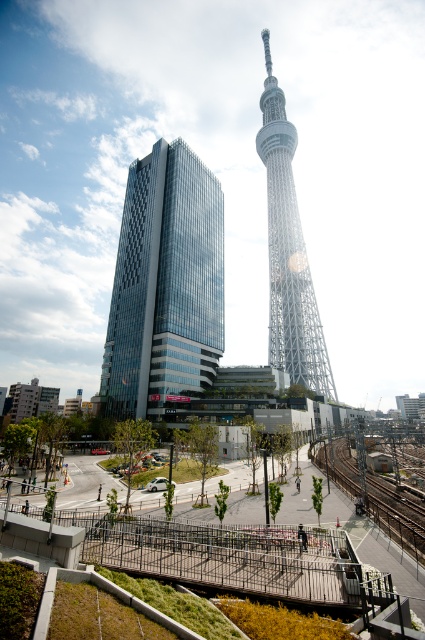
Question: Can you confirm if white lattice tower at center is positioned to the right of metal train track at lower center?

Choices:
 (A) no
 (B) yes

Answer: (B)

Question: Which object appears closest to the camera in this image?

Choices:
 (A) glassy modern building at center
 (B) white lattice tower at center
 (C) metal train track at lower center

Answer: (C)

Question: Which object is closer to the camera taking this photo?

Choices:
 (A) glassy modern building at center
 (B) white lattice tower at center

Answer: (A)

Question: Is the position of glassy modern building at center more distant than that of white lattice tower at center?

Choices:
 (A) no
 (B) yes

Answer: (A)

Question: Does glassy modern building at center lie behind metal train track at lower center?

Choices:
 (A) yes
 (B) no

Answer: (A)

Question: Estimate the real-world distances between objects in this image. Which object is farther from the glassy modern building at center?

Choices:
 (A) metal train track at lower center
 (B) white lattice tower at center

Answer: (A)